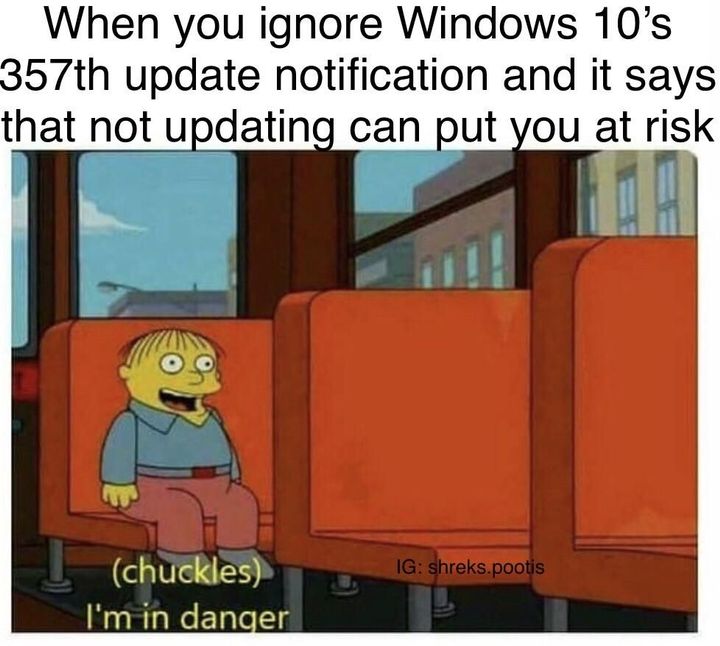
I want to click on floor, so click(x=50, y=612).